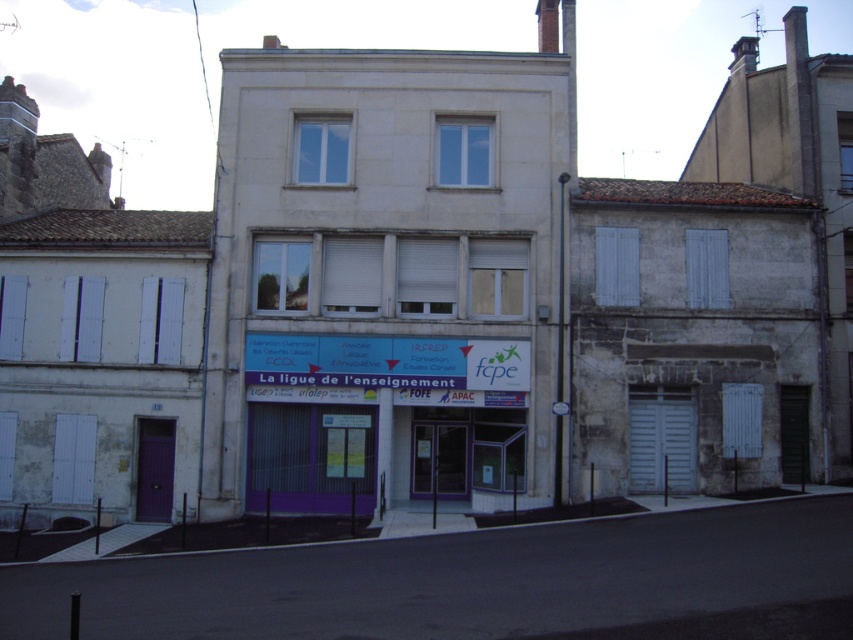
You are a delivery person standing 5 feet away from the white stone building at center. You need to place a package on the purple matte signboard at center. Can you reach it without moving closer than your current position?

The distance between the white stone building at center and the purple matte signboard at center is 8.41 feet. Since you are already 5 feet away from the white stone building at center, you are still 3.41 feet away from the purple matte signboard at center. Therefore, you cannot reach it without moving closer.

You are a tourist standing on the sidewalk in front of the white stone building at center and the purple matte signboard at center. Which object is positioned higher relative to the other?

The white stone building at center is located above the purple matte signboard at center, so it is positioned higher.

You are a tourist standing on the sidewalk and see the white stone building at center and the purple matte signboard at center. Which object is positioned more to the left from your viewpoint?

The white stone building at center is positioned more to the left than the purple matte signboard at center from your viewpoint.